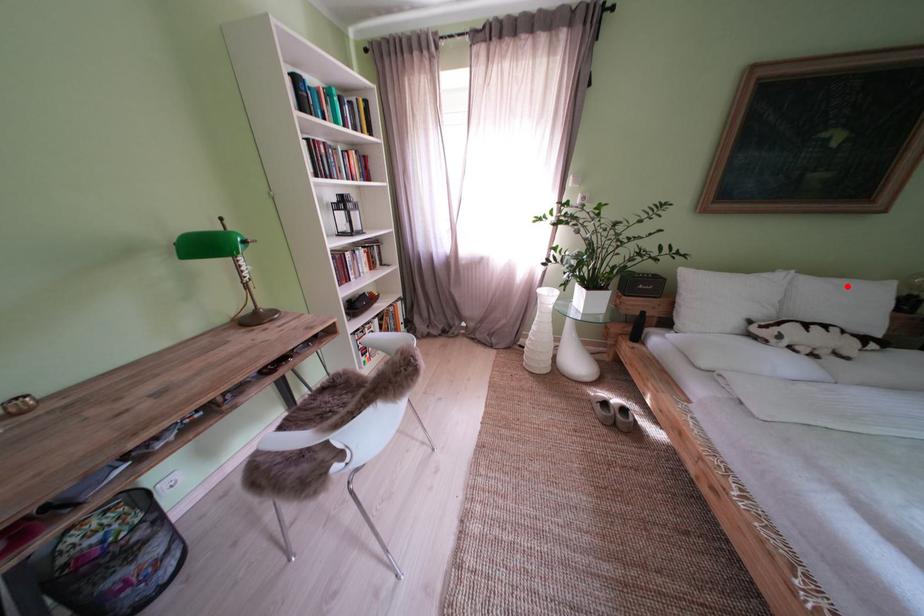
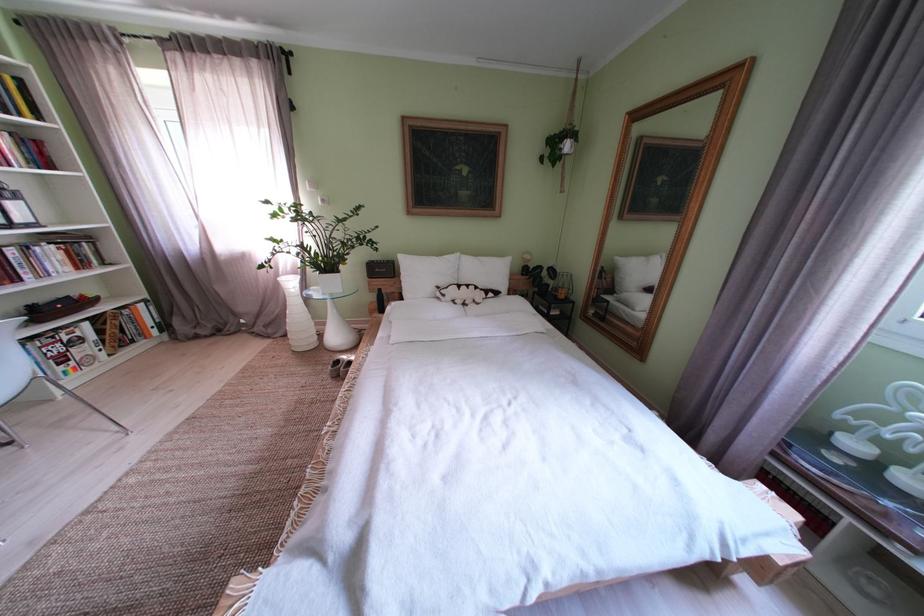
Find the pixel in the second image that matches the highlighted location in the first image.

(492, 264)